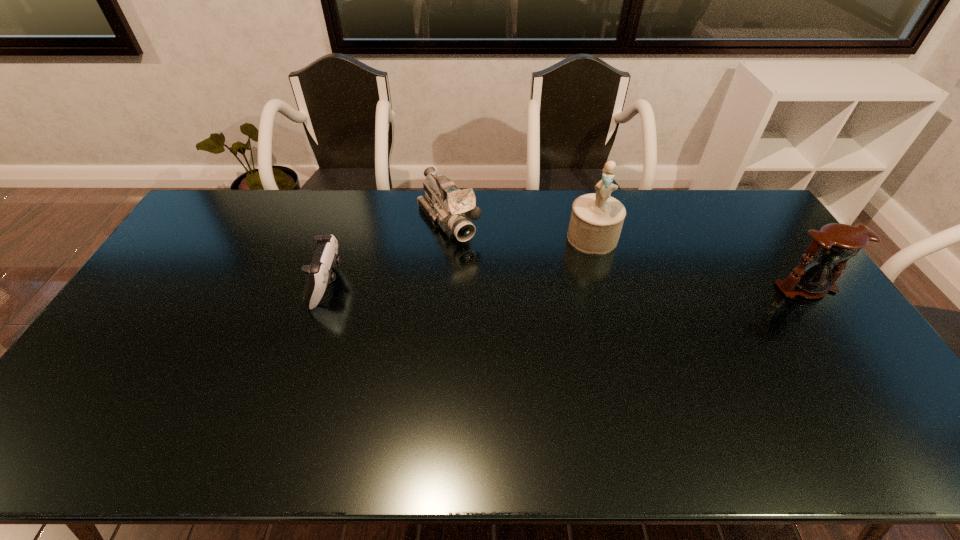
Find the location of a particular element. free space at the right edge is located at coordinates [766, 267].

Find the location of a particular element. free region at the far left corner of the desktop is located at coordinates (215, 207).

I want to click on vacant space at the near left corner of the desktop, so point(108,395).

You are a GUI agent. You are given a task and a screenshot of the screen. Output one action in this format:
    pyautogui.click(x=<x>, y=<y>)
    Task: Click on the free space at the near right corner of the desktop
    
    Given the screenshot: What is the action you would take?
    pyautogui.click(x=852, y=387)

The width and height of the screenshot is (960, 540). Find the location of `free space between the rightmost object and the control`. free space between the rightmost object and the control is located at coordinates (566, 286).

Locate an element on the screen. free space between the tallest object and the camcorder is located at coordinates (520, 230).

This screenshot has width=960, height=540. I want to click on free space between the third object from right to left and the figurine, so click(x=520, y=230).

The width and height of the screenshot is (960, 540). I want to click on vacant space in between the tallest object and the shortest object, so click(x=460, y=261).

Find the location of a particular element. free space between the rightmost object and the leftmost object is located at coordinates (566, 286).

Locate an element on the screen. free space between the figurine and the camcorder is located at coordinates (520, 230).